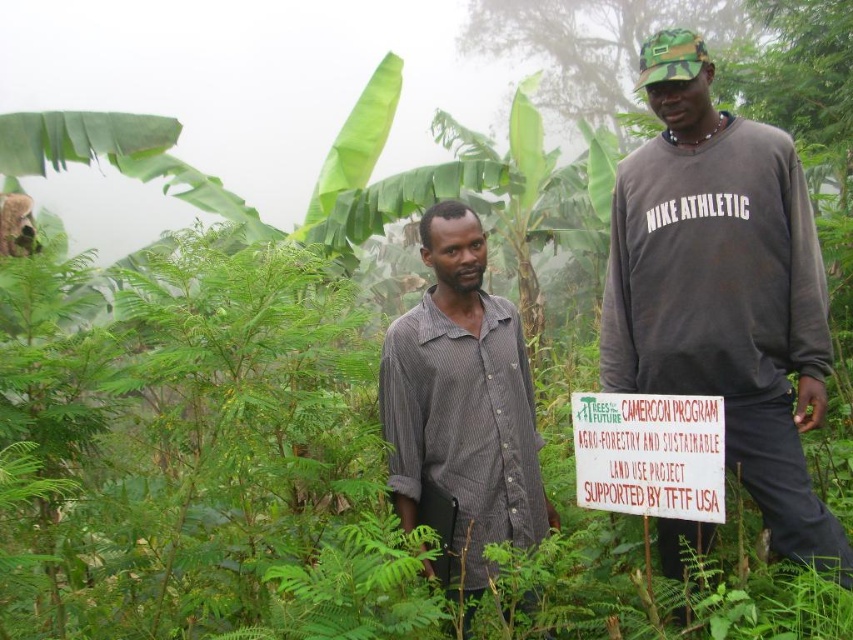
Which is behind, point (688, 122) or point (637, 403)?

Point (688, 122)

Who is more forward, (726,205) or (577,442)?

Point (726,205) is in front.

The width and height of the screenshot is (853, 640). Find the location of `dark gray sweatshirt at center`. dark gray sweatshirt at center is located at coordinates (723, 291).

Who is positioned more to the left, dark gray sweatshirt at center or gray striped shirt at center?

gray striped shirt at center is more to the left.

Who is more forward, (762,301) or (456,444)?

Positioned in front is point (762,301).

Where is `dark gray sweatshirt at center`? The width and height of the screenshot is (853, 640). dark gray sweatshirt at center is located at coordinates (723, 291).

Between gray striped shirt at center and white paper sign at center, which one appears on the right side from the viewer's perspective?

white paper sign at center is more to the right.

Between point (508, 518) and point (627, 412), which one is positioned behind?

Positioned behind is point (508, 518).

Locate an element on the screen. The image size is (853, 640). gray striped shirt at center is located at coordinates (461, 410).